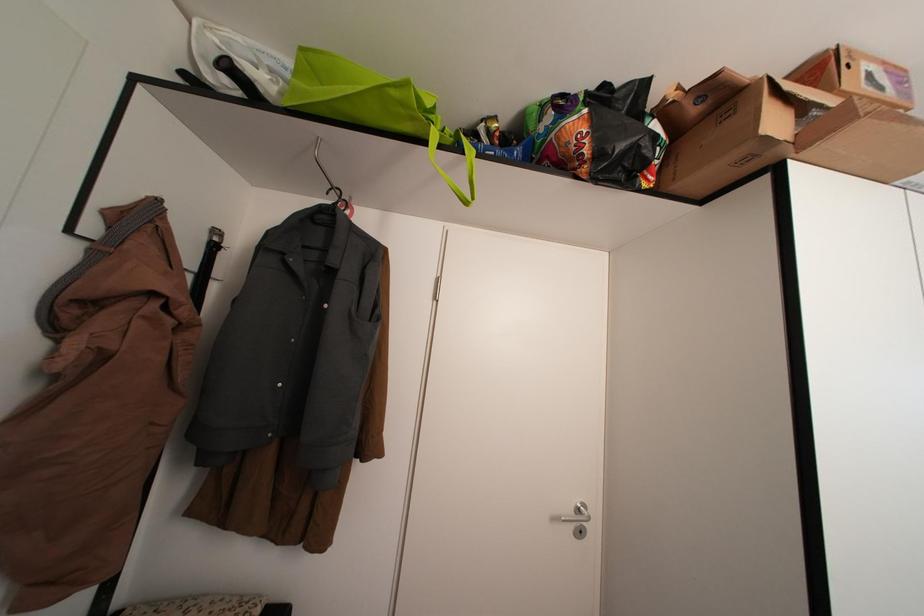
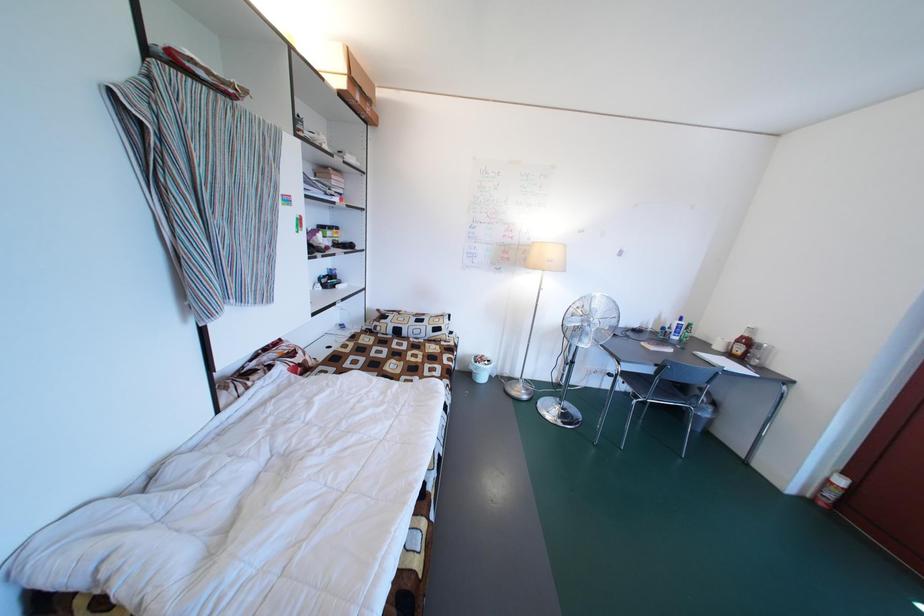
Question: The images are taken continuously from a first-person perspective. In which direction are you moving?

Choices:
 (A) Left
 (B) Right
 (C) Forward
 (D) Backward

Answer: (B)